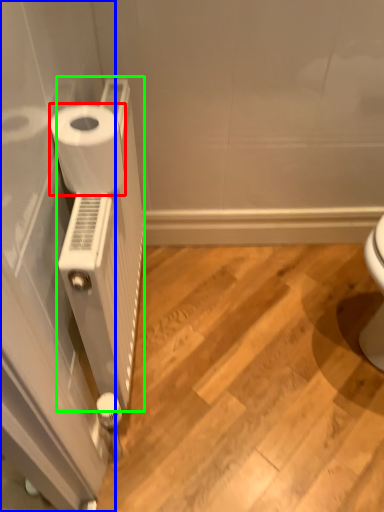
Question: Based on their relative distances, which object is nearer to toilet paper (highlighted by a red box)? Choose from screen door (highlighted by a blue box) and radiator (highlighted by a green box).

Choices:
 (A) screen door
 (B) radiator

Answer: (B)